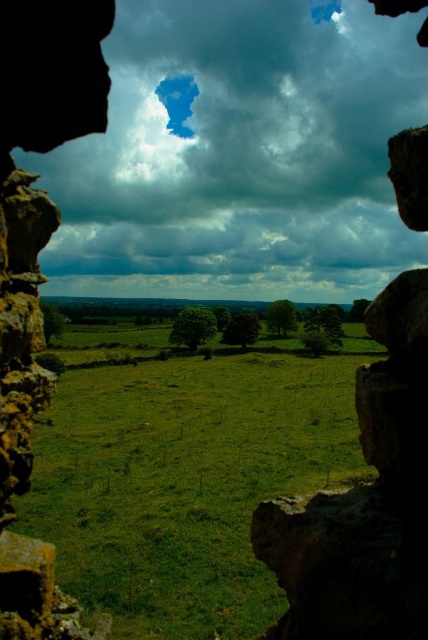
Is cloudy sky at center wider than green grass at center?

Correct, the width of cloudy sky at center exceeds that of green grass at center.

Which is in front, point (174, 266) or point (171, 416)?

Point (171, 416) is more forward.

Find the location of a particular element. cloudy sky at center is located at coordinates (240, 154).